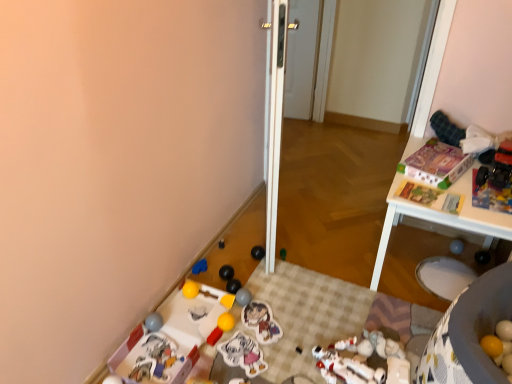
The width and height of the screenshot is (512, 384). What are the coordinates of `free space behind matte plastic sticker at center, placed as the ninth toy when sorted from right to left` in the screenshot? It's located at (246, 320).